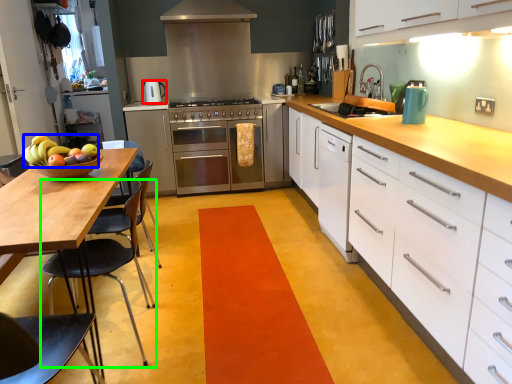
Question: Which is nearer to the kitchen appliance (highlighted by a red box)? fruit (highlighted by a blue box) or chair (highlighted by a green box).

Choices:
 (A) fruit
 (B) chair

Answer: (B)